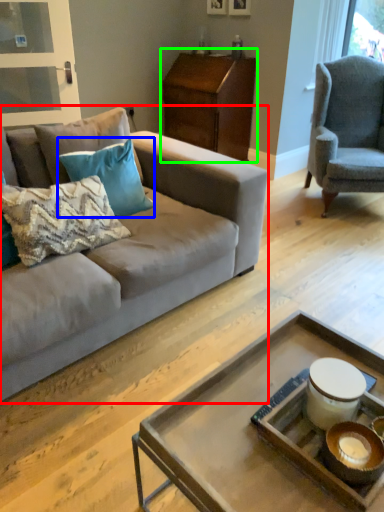
Question: Which object is positioned closest to studio couch (highlighted by a red box)? Select from pillow (highlighted by a blue box) and nightstand (highlighted by a green box).

Choices:
 (A) pillow
 (B) nightstand

Answer: (A)